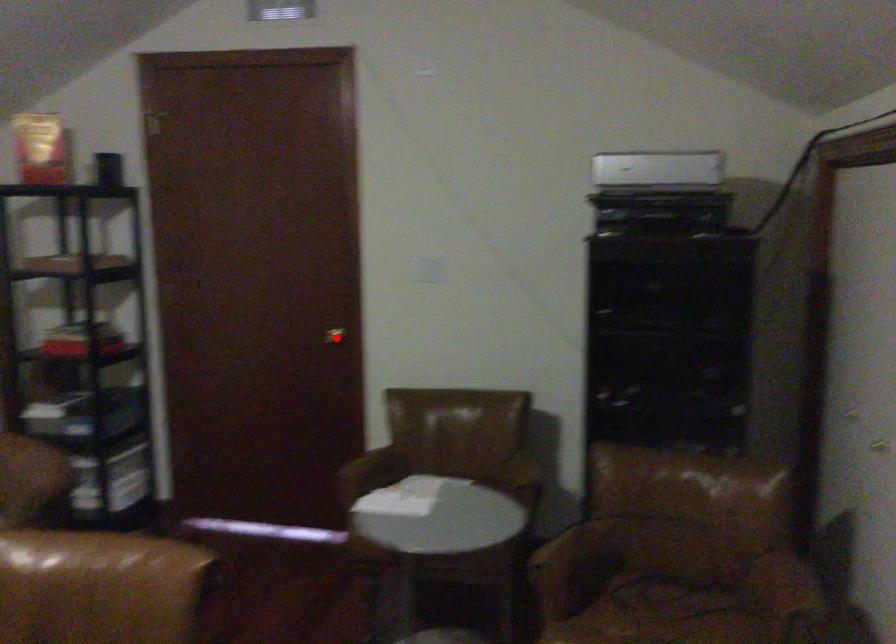
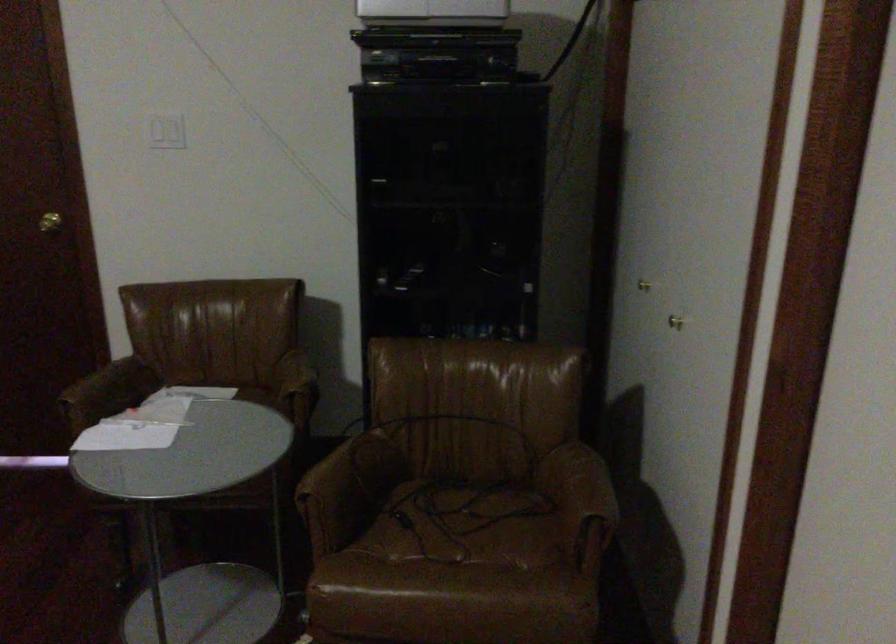
Question: I am providing you with two images of the same scene from different viewpoints. Given a red point in image1, look at the same physical point in image2. Is it:

Choices:
 (A) Closer to the viewpoint
 (B) Farther from the viewpoint

Answer: (A)